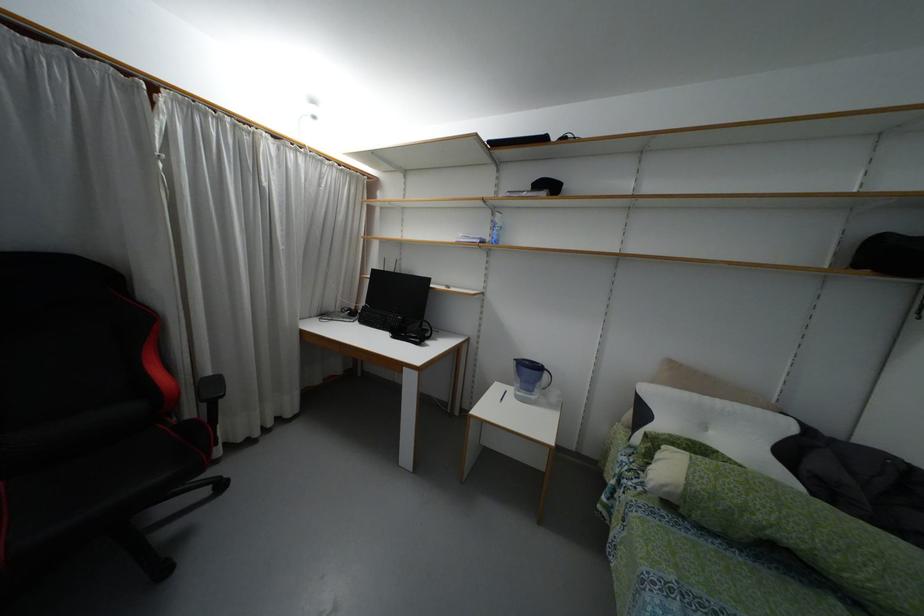
You are a GUI agent. You are given a task and a screenshot of the screen. Output one action in this format:
    pyautogui.click(x=<x>, y=<y>)
    Task: Click on the water pitcher handle
    The width and height of the screenshot is (924, 616).
    Given the screenshot: What is the action you would take?
    [545, 381]